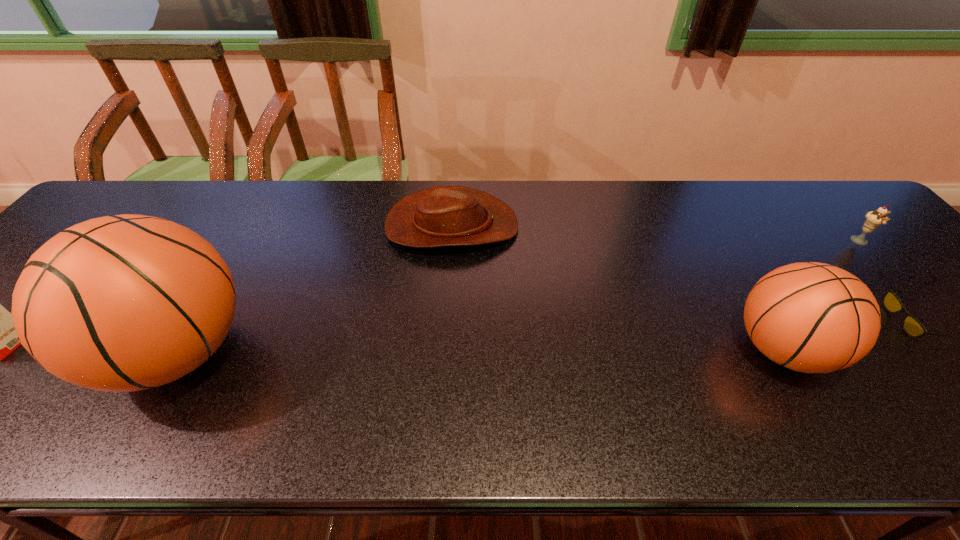
I want to click on blank area in the image that satisfies the following two spatial constraints: 1. on the front-facing side of the shortest object; 2. on the front side of the taller basketball, so click(x=938, y=353).